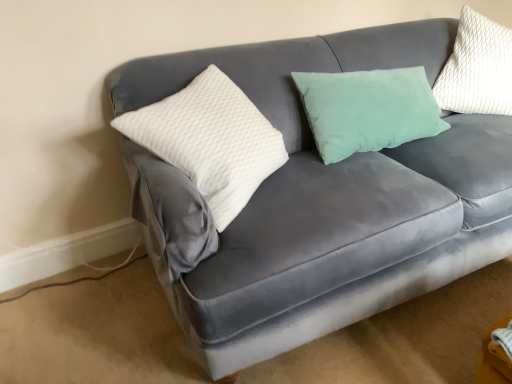
Describe the element at coordinates (477, 68) in the screenshot. Image resolution: width=512 pixels, height=384 pixels. I see `white textured pillow at upper right, the 1th pillow in the right-to-left sequence` at that location.

Find the location of a particular element. white textured pillow at upper right, placed as the second pillow when sorted from left to right is located at coordinates (477, 68).

How much space does white textured pillow at upper right, placed as the second pillow when sorted from left to right, occupy vertically?

white textured pillow at upper right, placed as the second pillow when sorted from left to right, is 22.27 inches in height.

Measure the distance between white textured pillow at upper right, placed as the second pillow when sorted from left to right, and camera.

1.73 meters.

What is the approximate width of white textured pillow at left, positioned as the 2th pillow in right-to-left order?

19.33 inches.

Locate an element on the screen. This screenshot has height=384, width=512. white textured pillow at left, positioned as the 2th pillow in right-to-left order is located at coordinates tap(210, 141).

This screenshot has height=384, width=512. What do you see at coordinates (210, 141) in the screenshot?
I see `white textured pillow at left, the first pillow viewed from the left` at bounding box center [210, 141].

You are a GUI agent. You are given a task and a screenshot of the screen. Output one action in this format:
    pyautogui.click(x=<x>, y=<y>)
    Task: Click on the white textured pillow at upper right, the 1th pillow in the right-to-left sequence
    The width and height of the screenshot is (512, 384).
    Given the screenshot: What is the action you would take?
    pyautogui.click(x=477, y=68)

Can you confirm if white textured pillow at left, positioned as the 2th pillow in right-to-left order, is positioned to the left of white textured pillow at upper right, placed as the second pillow when sorted from left to right?

Indeed, white textured pillow at left, positioned as the 2th pillow in right-to-left order, is positioned on the left side of white textured pillow at upper right, placed as the second pillow when sorted from left to right.

Which object is further away from the camera, white textured pillow at left, the first pillow viewed from the left, or white textured pillow at upper right, placed as the second pillow when sorted from left to right?

white textured pillow at upper right, placed as the second pillow when sorted from left to right, is further from the camera.

Does point (244, 127) come closer to viewer compared to point (511, 54)?

Yes.

From the image's perspective, between white textured pillow at left, the first pillow viewed from the left, and white textured pillow at upper right, the 1th pillow in the right-to-left sequence, who is located below?

white textured pillow at left, the first pillow viewed from the left, is shown below in the image.

From a real-world perspective, does white textured pillow at left, positioned as the 2th pillow in right-to-left order, stand above white textured pillow at upper right, the 1th pillow in the right-to-left sequence?

No.

Is white textured pillow at left, positioned as the 2th pillow in right-to-left order, wider than white textured pillow at upper right, placed as the second pillow when sorted from left to right?

Correct, the width of white textured pillow at left, positioned as the 2th pillow in right-to-left order, exceeds that of white textured pillow at upper right, placed as the second pillow when sorted from left to right.

Is white textured pillow at left, positioned as the 2th pillow in right-to-left order, taller or shorter than white textured pillow at upper right, placed as the second pillow when sorted from left to right?

Considering their sizes, white textured pillow at left, positioned as the 2th pillow in right-to-left order, has less height than white textured pillow at upper right, placed as the second pillow when sorted from left to right.

Which of these two, white textured pillow at left, positioned as the 2th pillow in right-to-left order, or white textured pillow at upper right, the 1th pillow in the right-to-left sequence, is bigger?

white textured pillow at left, positioned as the 2th pillow in right-to-left order.

Is white textured pillow at left, positioned as the 2th pillow in right-to-left order, inside or outside of white textured pillow at upper right, the 1th pillow in the right-to-left sequence?

white textured pillow at left, positioned as the 2th pillow in right-to-left order, is located beyond the bounds of white textured pillow at upper right, the 1th pillow in the right-to-left sequence.

Is white textured pillow at left, the first pillow viewed from the left, with white textured pillow at upper right, the 1th pillow in the right-to-left sequence?

No.

Is white textured pillow at left, positioned as the 2th pillow in right-to-left order, facing towards white textured pillow at upper right, the 1th pillow in the right-to-left sequence?

No, white textured pillow at left, positioned as the 2th pillow in right-to-left order, is not turned towards white textured pillow at upper right, the 1th pillow in the right-to-left sequence.

What's the angular difference between white textured pillow at left, the first pillow viewed from the left, and white textured pillow at upper right, placed as the second pillow when sorted from left to right,'s facing directions?

81.2 degrees separate the facing orientations of white textured pillow at left, the first pillow viewed from the left, and white textured pillow at upper right, placed as the second pillow when sorted from left to right.

Locate an element on the screen. The height and width of the screenshot is (384, 512). pillow located behind the white textured pillow at left, the first pillow viewed from the left is located at coordinates click(x=477, y=68).

Does white textured pillow at upper right, the 1th pillow in the right-to-left sequence, appear on the right side of white textured pillow at left, positioned as the 2th pillow in right-to-left order?

Yes.

Is white textured pillow at upper right, placed as the second pillow when sorted from left to right, closer to the viewer compared to white textured pillow at left, positioned as the 2th pillow in right-to-left order?

No, it is not.

Does point (503, 41) appear closer or farther from the camera than point (206, 114)?

Point (503, 41) is positioned farther from the camera compared to point (206, 114).

From the image's perspective, is white textured pillow at upper right, the 1th pillow in the right-to-left sequence, under white textured pillow at left, positioned as the 2th pillow in right-to-left order?

Actually, white textured pillow at upper right, the 1th pillow in the right-to-left sequence, appears above white textured pillow at left, positioned as the 2th pillow in right-to-left order, in the image.

From a real-world perspective, is white textured pillow at upper right, the 1th pillow in the right-to-left sequence, beneath white textured pillow at left, the first pillow viewed from the left?

No, from a real-world perspective, white textured pillow at upper right, the 1th pillow in the right-to-left sequence, is not under white textured pillow at left, the first pillow viewed from the left.

Is white textured pillow at upper right, the 1th pillow in the right-to-left sequence, wider than white textured pillow at left, positioned as the 2th pillow in right-to-left order?

In fact, white textured pillow at upper right, the 1th pillow in the right-to-left sequence, might be narrower than white textured pillow at left, positioned as the 2th pillow in right-to-left order.

Considering the relative sizes of white textured pillow at upper right, placed as the second pillow when sorted from left to right, and white textured pillow at left, the first pillow viewed from the left, in the image provided, is white textured pillow at upper right, placed as the second pillow when sorted from left to right, taller than white textured pillow at left, the first pillow viewed from the left,?

Correct, white textured pillow at upper right, placed as the second pillow when sorted from left to right, is much taller as white textured pillow at left, the first pillow viewed from the left.

From the picture: Between white textured pillow at upper right, the 1th pillow in the right-to-left sequence, and white textured pillow at left, the first pillow viewed from the left, which one has larger size?

With larger size is white textured pillow at left, the first pillow viewed from the left.

Is white textured pillow at upper right, the 1th pillow in the right-to-left sequence, outside of white textured pillow at left, the first pillow viewed from the left?

Yes.

Is white textured pillow at upper right, the 1th pillow in the right-to-left sequence, far from white textured pillow at left, positioned as the 2th pillow in right-to-left order?

white textured pillow at upper right, the 1th pillow in the right-to-left sequence, is actually quite close to white textured pillow at left, positioned as the 2th pillow in right-to-left order.

In the scene shown: Is white textured pillow at upper right, the 1th pillow in the right-to-left sequence, looking in the opposite direction of white textured pillow at left, the first pillow viewed from the left?

No.

What's the angular difference between white textured pillow at upper right, the 1th pillow in the right-to-left sequence, and white textured pillow at left, the first pillow viewed from the left,'s facing directions?

81.2 degrees.

This screenshot has height=384, width=512. What are the coordinates of `pillow located below the white textured pillow at upper right, the 1th pillow in the right-to-left sequence (from the image's perspective)` in the screenshot? It's located at (210, 141).

I want to click on pillow behind the white textured pillow at left, positioned as the 2th pillow in right-to-left order, so click(477, 68).

Identify the location of pillow above the white textured pillow at left, positioned as the 2th pillow in right-to-left order (from the image's perspective). Image resolution: width=512 pixels, height=384 pixels. (477, 68).